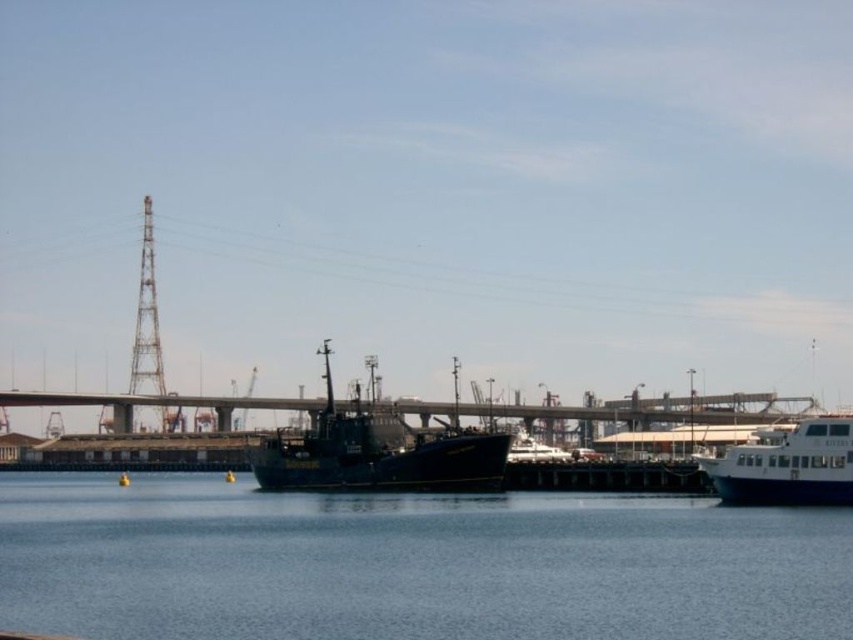
Between blue water at center and matte black ship at center, which one is positioned higher?

matte black ship at center is above.

Where is `blue water at center`? Image resolution: width=853 pixels, height=640 pixels. blue water at center is located at coordinates click(x=410, y=564).

Which is below, blue water at center or white glossy ferry at right?

Positioned lower is blue water at center.

Who is positioned more to the left, blue water at center or white glossy ferry at right?

blue water at center is more to the left.

The width and height of the screenshot is (853, 640). What are the coordinates of `blue water at center` in the screenshot? It's located at (410, 564).

This screenshot has height=640, width=853. I want to click on blue water at center, so click(410, 564).

Which is behind, point (492, 484) or point (741, 476)?

Positioned behind is point (492, 484).

Describe the element at coordinates (376, 452) in the screenshot. I see `matte black ship at center` at that location.

The height and width of the screenshot is (640, 853). I want to click on matte black ship at center, so (376, 452).